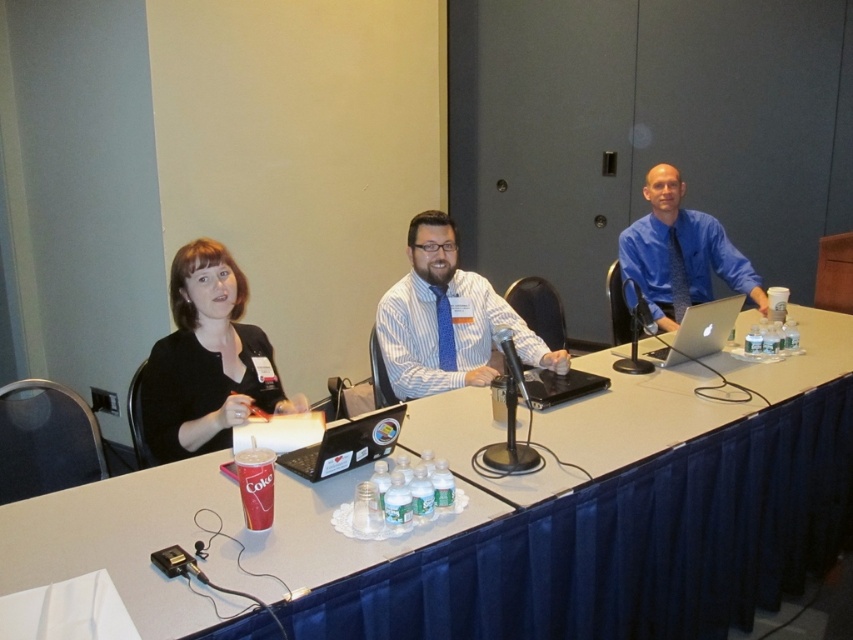
Question: Considering the relative positions of white plastic table at center and black matte laptop at center in the image provided, where is white plastic table at center located with respect to black matte laptop at center?

Choices:
 (A) below
 (B) above

Answer: (A)

Question: Is matte black shirt at left below blue striped shirt at center?

Choices:
 (A) yes
 (B) no

Answer: (A)

Question: Is white plastic table at center positioned before silver metallic laptop at center?

Choices:
 (A) no
 (B) yes

Answer: (B)

Question: Which point is closer to the camera taking this photo?

Choices:
 (A) (772, 365)
 (B) (680, 260)
 (C) (730, 307)

Answer: (A)

Question: Which point is closer to the camera?

Choices:
 (A) (432, 262)
 (B) (292, 410)
 (C) (241, 600)

Answer: (C)

Question: Which of the following is the farthest from the observer?

Choices:
 (A) (689, 333)
 (B) (461, 304)
 (C) (206, 256)

Answer: (B)